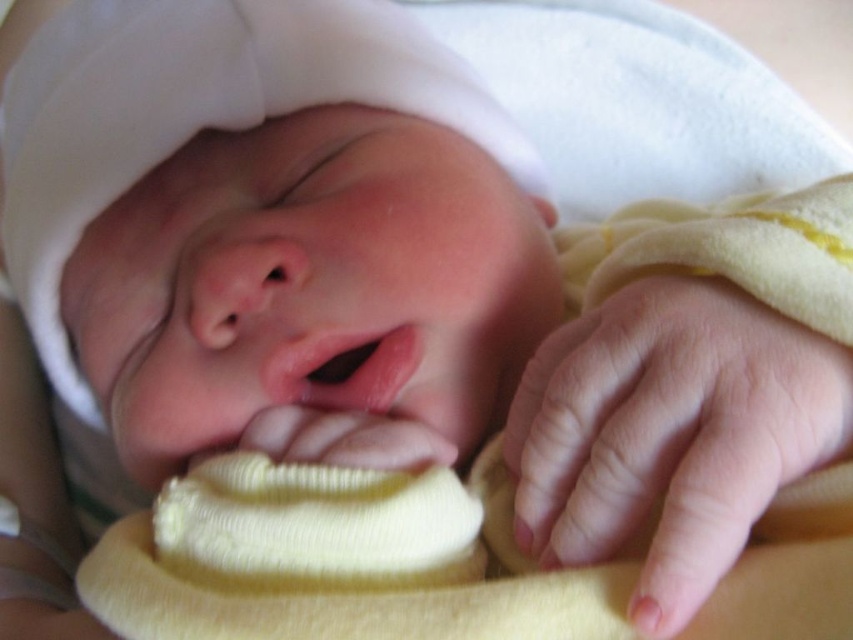
Between pink smooth skin at center and smooth pink lips at center, which one has more height?

pink smooth skin at center is taller.

Which is above, pink smooth skin at center or smooth pink lips at center?

Positioned higher is smooth pink lips at center.

Who is more forward, (705, 570) or (381, 358)?

Point (705, 570) is more forward.

The height and width of the screenshot is (640, 853). In order to click on pink smooth skin at center in this screenshot , I will do `click(670, 433)`.